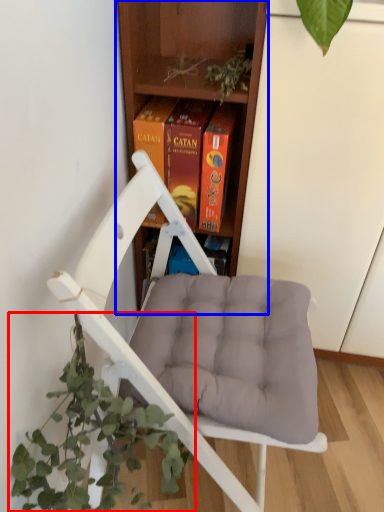
Question: Which of the following is the farthest to the observer, houseplant (highlighted by a red box) or shelf (highlighted by a blue box)?

Choices:
 (A) houseplant
 (B) shelf

Answer: (B)